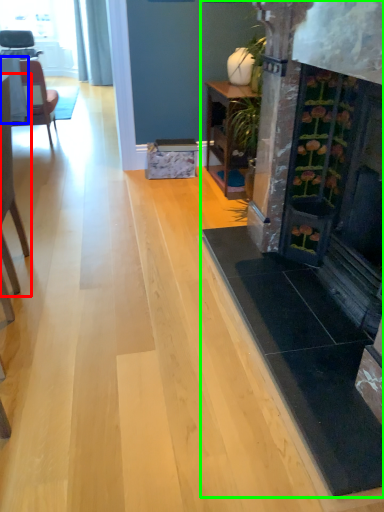
Question: Which is nearer to the chair (highlighted by a red box)? table (highlighted by a blue box) or fireplace (highlighted by a green box).

Choices:
 (A) table
 (B) fireplace

Answer: (B)